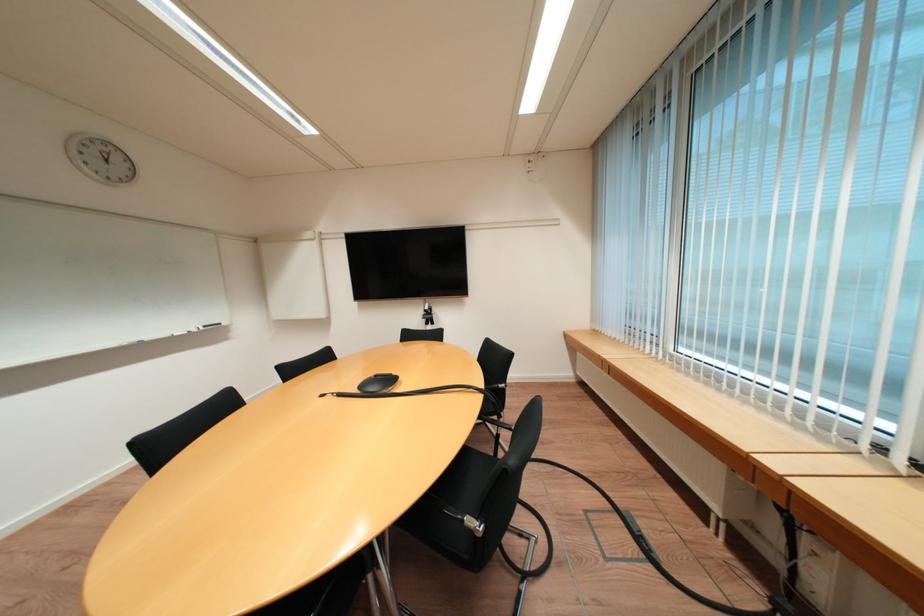
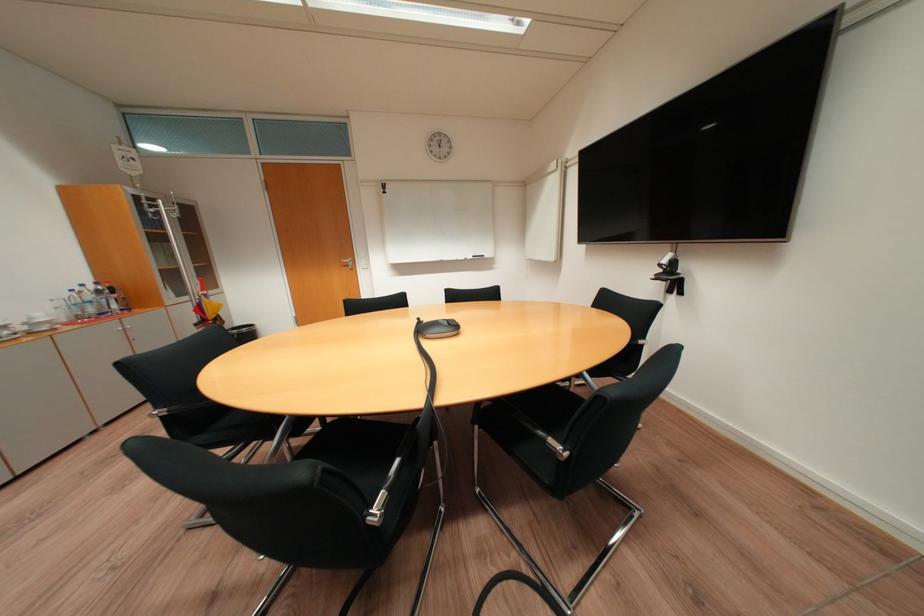
Locate, in the second image, the point that corresponds to the point at 435,310 in the first image.

(673, 262)